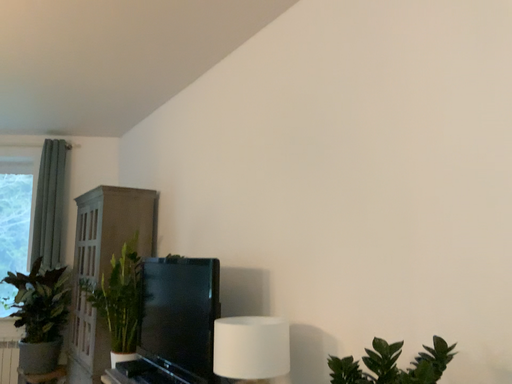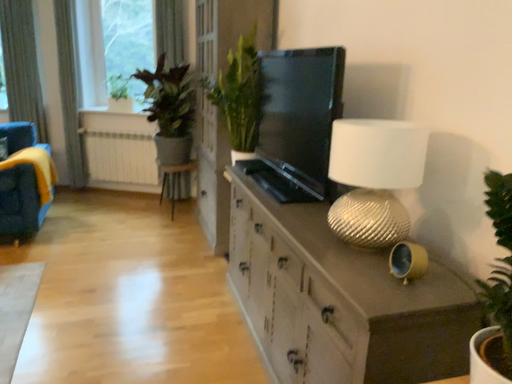
Question: How did the camera likely rotate when shooting the video?

Choices:
 (A) rotated downward
 (B) rotated upward

Answer: (A)